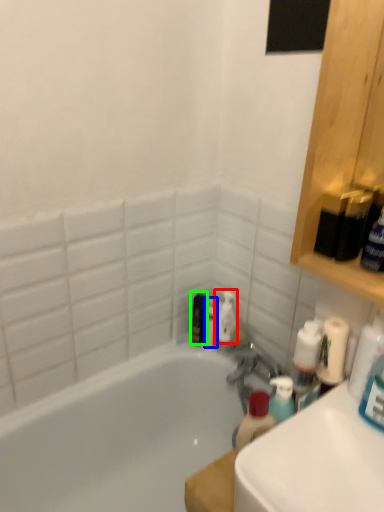
Question: Which object is the farthest from cleaning product (highlighted by a red box)? Choose among these: toiletry (highlighted by a blue box) or toiletry (highlighted by a green box).

Choices:
 (A) toiletry
 (B) toiletry

Answer: (B)